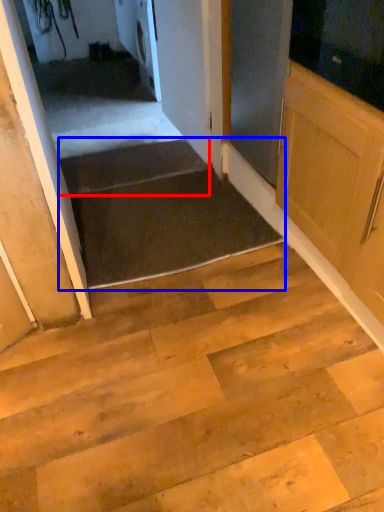
Question: Which object is closer to the camera taking this photo, stairs (highlighted by a red box) or stairwell (highlighted by a blue box)?

Choices:
 (A) stairs
 (B) stairwell

Answer: (B)